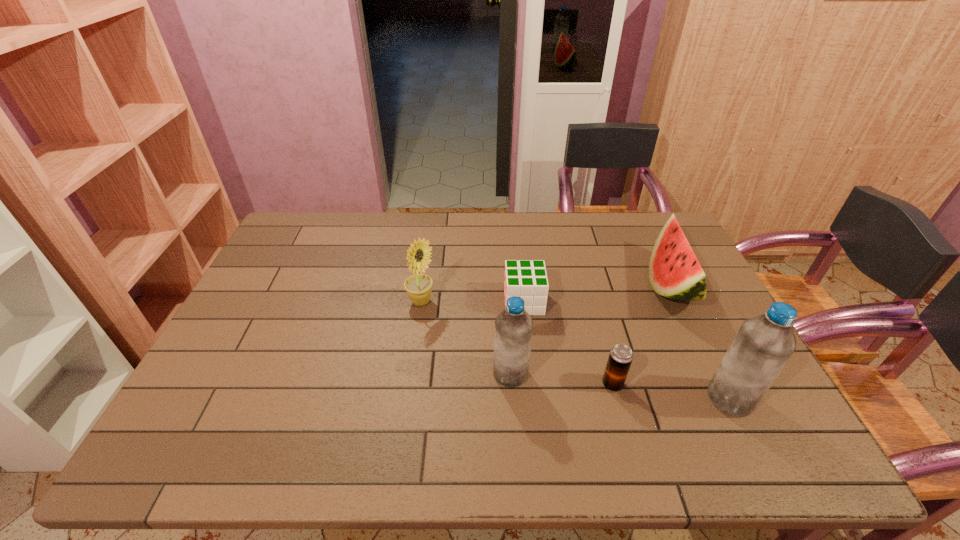
This screenshot has width=960, height=540. I want to click on watermelon that is at the right edge, so click(674, 272).

This screenshot has width=960, height=540. Find the location of `object that is at the far right corner`. object that is at the far right corner is located at coordinates [674, 272].

At what (x,y) coordinates should I click in order to perform the action: click on object that is at the near right corner. Please return your answer as a coordinate pair (x, y). The height and width of the screenshot is (540, 960). Looking at the image, I should click on (763, 345).

I want to click on free space at the far edge of the desktop, so click(x=588, y=245).

The width and height of the screenshot is (960, 540). Identify the location of vacant region at the near edge of the desktop. (358, 407).

The image size is (960, 540). Identify the location of vacant space at the left edge of the desktop. (276, 305).

In the image, there is a desktop. Find the location of `vacant region at the right edge`. vacant region at the right edge is located at coordinates (686, 346).

The height and width of the screenshot is (540, 960). In the image, there is a desktop. What are the coordinates of `vacant space at the far left corner` in the screenshot? It's located at (306, 243).

The image size is (960, 540). What are the coordinates of `free region at the far right corner of the desktop` in the screenshot? It's located at (656, 218).

Locate an element on the screen. This screenshot has width=960, height=540. vacant area that lies between the fourth object from left to right and the left water bottle is located at coordinates (562, 379).